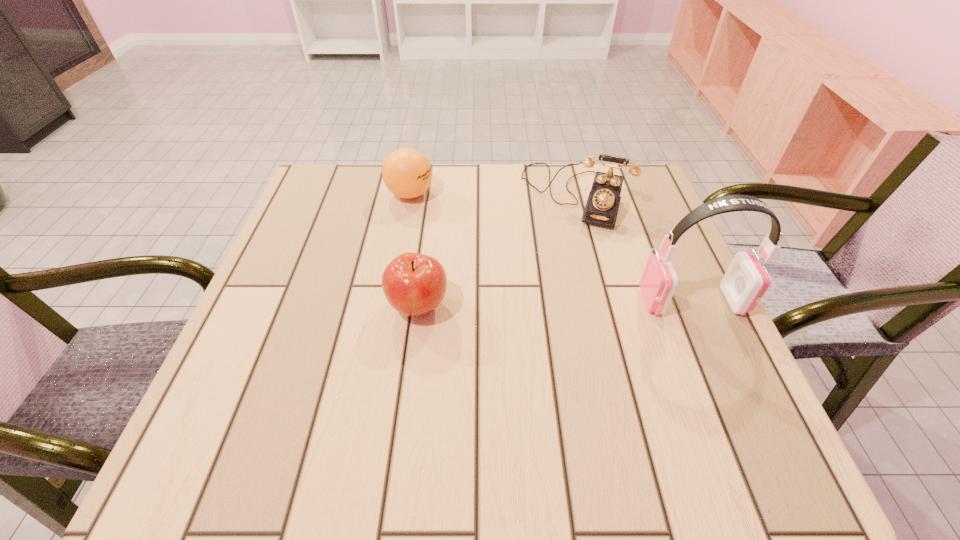
Locate an element on the screen. vacant region between the telephone and the ping-pong ball is located at coordinates (492, 194).

Where is `object that ranks as the second closest to the ping-pong ball`? Image resolution: width=960 pixels, height=540 pixels. object that ranks as the second closest to the ping-pong ball is located at coordinates (414, 284).

Where is `the closest object to the telephone`? the closest object to the telephone is located at coordinates (745, 283).

Where is `vacant area that satisfies the following two spatial constraints: 1. on the front side of the tallest object; 2. on the outer surface of the ping-pong ball`? This screenshot has height=540, width=960. vacant area that satisfies the following two spatial constraints: 1. on the front side of the tallest object; 2. on the outer surface of the ping-pong ball is located at coordinates (391, 301).

This screenshot has height=540, width=960. I want to click on free space that satisfies the following two spatial constraints: 1. on the front side of the telephone; 2. on the right side of the ping-pong ball, so click(410, 195).

Find the location of `free spot that satisfies the following two spatial constraints: 1. on the front side of the telephone; 2. on the outer surface of the earphone`. free spot that satisfies the following two spatial constraints: 1. on the front side of the telephone; 2. on the outer surface of the earphone is located at coordinates (601, 301).